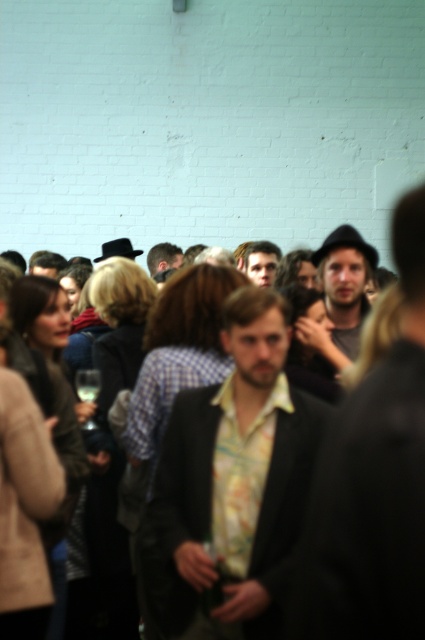
Between floral-patterned shirt at center and matte yellow shirt at center, which one appears on the left side from the viewer's perspective?

floral-patterned shirt at center is more to the left.

Does floral-patterned shirt at center appear under matte yellow shirt at center?

Correct, floral-patterned shirt at center is located below matte yellow shirt at center.

What are the coordinates of `floral-patterned shirt at center` in the screenshot? It's located at pyautogui.click(x=374, y=461).

The image size is (425, 640). I want to click on matte black hat at center, so click(343, 275).

Which is behind, point (359, 264) or point (172, 248)?

Positioned behind is point (172, 248).

This screenshot has width=425, height=640. I want to click on matte black hat at center, so click(x=343, y=275).

Between floral print shirt at center and floral-patterned shirt at center, which one is positioned lower?

floral print shirt at center

Which is in front, point (167, 552) or point (414, 552)?

Positioned in front is point (414, 552).

Is point (180, 552) positioned behind point (357, 394)?

Yes, it is.

At what (x,y) coordinates should I click in order to perform the action: click on floral print shirt at center. Please return your answer as a coordinate pair (x, y). Looking at the image, I should click on (238, 476).